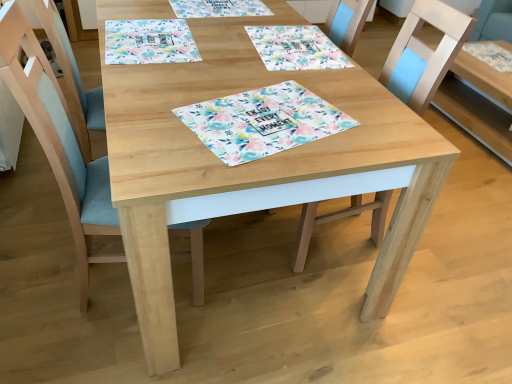
Question: From a real-world perspective, is floral fabric placemat at upper center above or below floral paper placemat at center?

Choices:
 (A) above
 (B) below

Answer: (B)

Question: From the image's perspective, relative to floral paper placemat at center, is floral fabric placemat at upper center above or below?

Choices:
 (A) above
 (B) below

Answer: (A)

Question: Based on their relative distances, which object is farther from the floral paper placemat at center?

Choices:
 (A) floral fabric placemat at upper center
 (B) light blue fabric chair at left, marked as the 2th chair in a right-to-left arrangement
 (C) natural wood table at right, which is counted as the first table, starting from the right
 (D) natural wood table at center, which appears as the first table when viewed from the left
 (E) wooden chair at center, which appears as the 1th chair when viewed from the right

Answer: (C)

Question: Estimate the real-world distances between objects in this image. Which object is closer to the floral fabric placemat at upper center?

Choices:
 (A) natural wood table at right, acting as the second table starting from the left
 (B) floral paper placemat at center
 (C) light blue fabric chair at left, acting as the 1th chair starting from the left
 (D) natural wood table at center, which appears as the first table when viewed from the left
 (E) wooden chair at center, acting as the 2th chair starting from the left

Answer: (D)